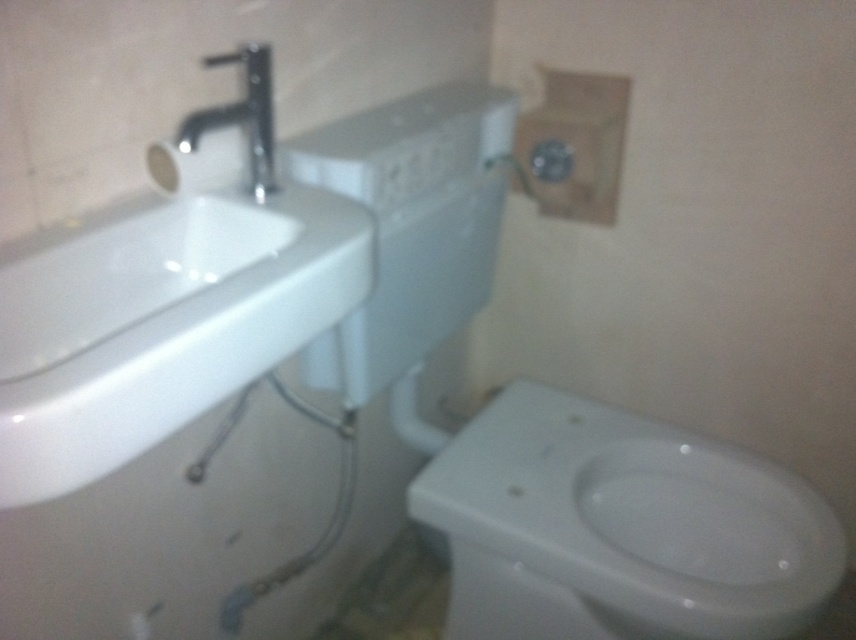
Which of these two, white glossy bidet at lower right or white matte toilet paper at upper left, stands shorter?

Result: With less height is white matte toilet paper at upper left.

Is the position of white glossy bidet at lower right less distant than that of white matte toilet paper at upper left?

That is False.

Is point (628, 506) positioned behind point (230, 150)?

Yes.

Find the location of `white glossy bidet at lower right`. white glossy bidet at lower right is located at coordinates (619, 529).

Is white glossy sink at upper left behind white matte toilet paper at upper left?

No.

Between point (218, 275) and point (193, 179), which one is positioned in front?

Positioned in front is point (193, 179).

What are the coordinates of `white glossy sink at upper left` in the screenshot? It's located at (158, 321).

The width and height of the screenshot is (856, 640). Describe the element at coordinates (241, 116) in the screenshot. I see `polished chrome faucet at upper left` at that location.

Identify the location of polished chrome faucet at upper left. (241, 116).